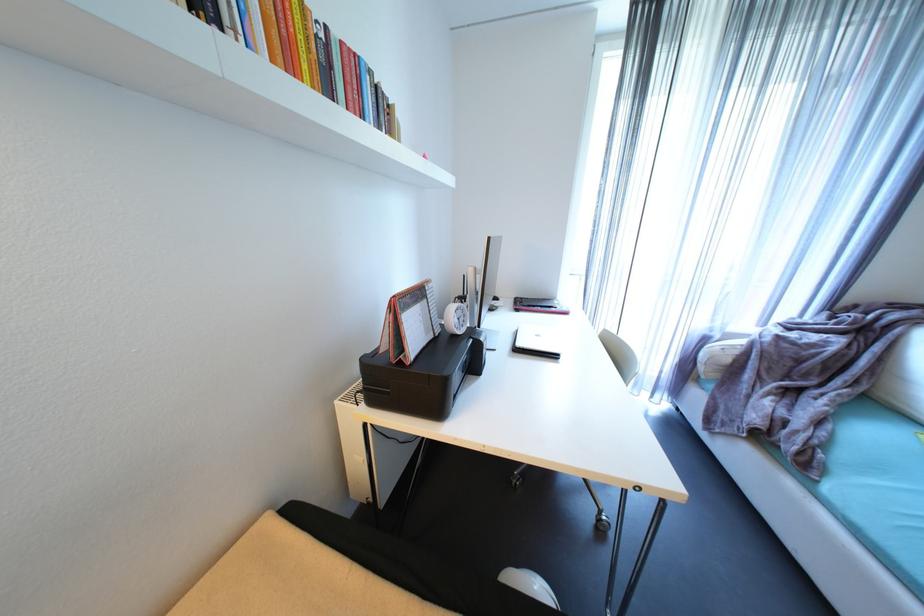
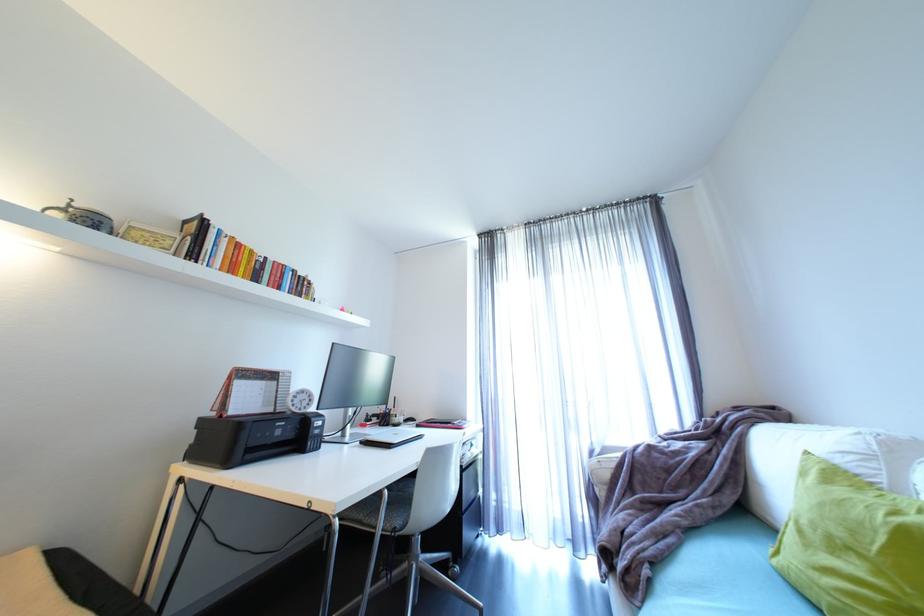
In the second image, find the point that corresponds to point (238, 34) in the first image.

(208, 262)